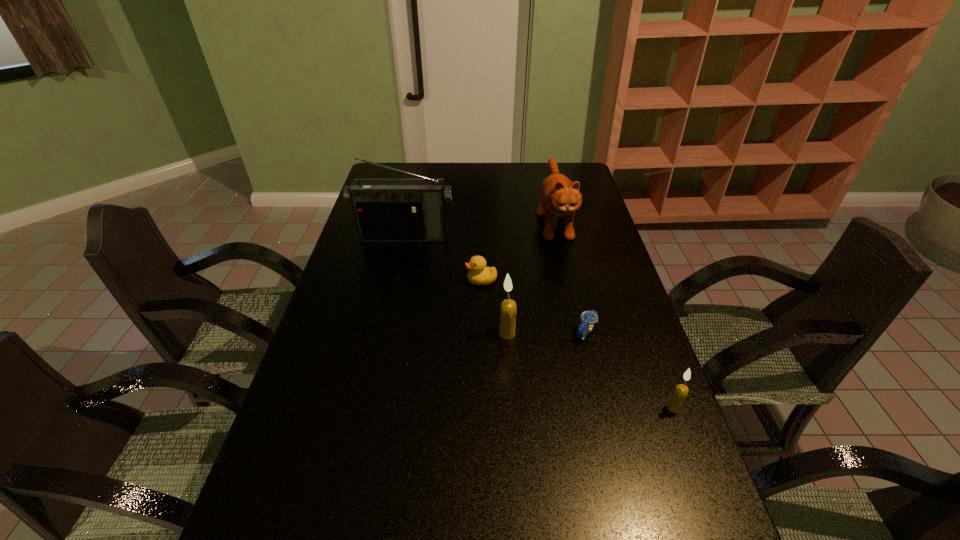
Image resolution: width=960 pixels, height=540 pixels. In order to click on free space between the shortest object and the right candle in this screenshot , I will do `click(630, 370)`.

The image size is (960, 540). I want to click on free space between the shortest object and the radio receiver, so click(x=495, y=285).

Image resolution: width=960 pixels, height=540 pixels. Identify the location of free space between the radio receiver and the watch. (495, 285).

Where is `vacant region between the cat and the shortest object`? The height and width of the screenshot is (540, 960). vacant region between the cat and the shortest object is located at coordinates (570, 275).

I want to click on vacant area between the radio receiver and the cat, so click(x=479, y=227).

Locate an element on the screen. blank region between the second shortest object and the cat is located at coordinates (517, 249).

Locate an element on the screen. free spot between the farther candle and the shortest object is located at coordinates (546, 333).

This screenshot has width=960, height=540. I want to click on empty location between the left candle and the leftmost object, so click(456, 285).

Select which object is the closest to the fourth nearest object. Please provide its 2D coordinates. Your answer should be formatted as a tuple, i.e. [(x, y)], where the tuple contains the x and y coordinates of a point satisfying the conditions above.

[(508, 310)]

This screenshot has height=540, width=960. Identify the location of object identified as the fifth closest to the nearer candle. (386, 210).